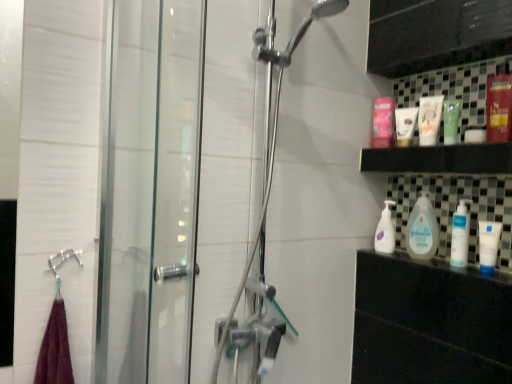
Question: From the image's perspective, relative to matte white lotion at upper right, which is the first toiletry from front to back, is matte white tube at upper right, which is counted as the 2th toiletry, starting from the front, above or below?

Choices:
 (A) above
 (B) below

Answer: (B)

Question: In terms of width, does matte white tube at upper right, arranged as the first toiletry when viewed from the back, look wider or thinner when compared to matte white lotion at upper right, arranged as the 2th toiletry when viewed from the back?

Choices:
 (A) thin
 (B) wide

Answer: (A)

Question: Considering the real-world distances, which object is closest to the white glossy baby lotion at center, which appears as the first cleaning product when viewed from the back?

Choices:
 (A) brushed metal towel ring at lower left
 (B) white plastic pump bottle at lower right, the 2th cleaning product positioned from the back
 (C) white matte tube at right
 (D) metallic red mouthwash at upper right, arranged as the 4th mouthwash when viewed from the left
 (E) pink glossy mouthwash at upper right, positioned as the 1th mouthwash in left-to-right order

Answer: (B)

Question: Which is farther from the white glossy mouthwash at right, arranged as the 3th mouthwash when viewed from the right?

Choices:
 (A) brushed metal towel ring at lower left
 (B) white glossy baby lotion at center, positioned as the second cleaning product in front-to-back order
 (C) green matte tube at upper right, which is the 3th mouthwash in back-to-front order
 (D) white plastic pump bottle at lower right, which appears as the 1th cleaning product when viewed from the front
 (E) metallic red mouthwash at upper right, the fourth mouthwash in the back-to-front sequence

Answer: (A)